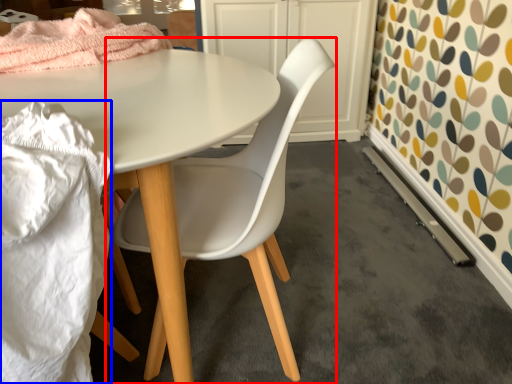
Question: Which object is further to the camera taking this photo, chair (highlighted by a red box) or material (highlighted by a blue box)?

Choices:
 (A) chair
 (B) material

Answer: (A)